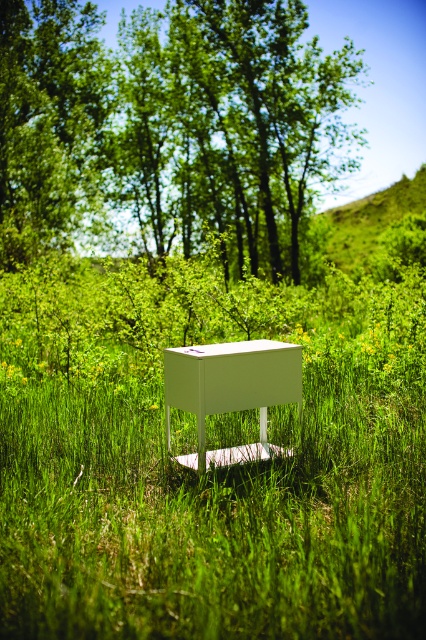
You are planning to set up a picnic at the white matte table at center. Considering the green leafy tree at upper center, will you have shade over the table during the day?

The green leafy tree at upper center is positioned over the white matte table at center, so yes, the table will be shaded by the tree during the day.

You are standing in the serene outdoor setting and want to take a photo of the green leafy trees at upper center and the green leafy tree at upper center. Which one is closer to the camera?

The green leafy trees at upper center is positioned under green leafy tree at upper center, so the green leafy tree at upper center is closer to the camera.

You are a landscape architect designing a garden. You have two types of trees to plant in the center area. The first type is labeled as green leafy trees at upper center, and the second type is green leafy tree at upper center. Which tree type should you choose if you want a wider canopy for shade?

You should choose the green leafy trees at upper center because their width is larger than the green leafy tree at upper center, providing a wider canopy for shade.